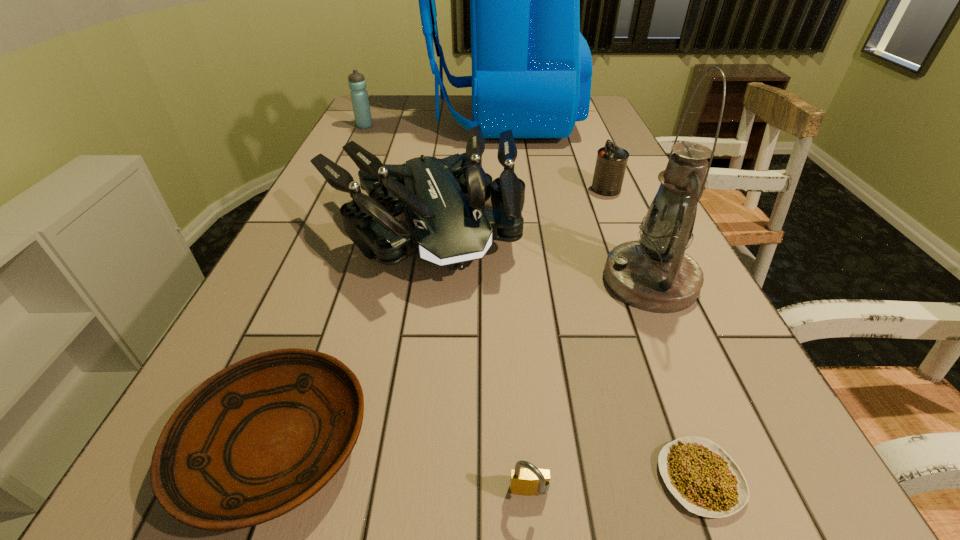
Identify the location of oil lamp situated at the right edge. (654, 274).

Identify the location of can that is at the right edge. The image size is (960, 540). (611, 162).

Identify the location of legume positioned at the right edge. Image resolution: width=960 pixels, height=540 pixels. (699, 473).

Image resolution: width=960 pixels, height=540 pixels. In order to click on object that is at the far right corner in this screenshot , I will do `click(531, 67)`.

This screenshot has width=960, height=540. Find the location of `object that is at the near right corner`. object that is at the near right corner is located at coordinates (699, 473).

In the image, there is a desktop. At what (x,y) coordinates should I click in order to perform the action: click on vacant space at the far edge. Please return your answer as a coordinate pair (x, y). The image size is (960, 540). Looking at the image, I should click on (473, 119).

Where is `free space at the near edge`? Image resolution: width=960 pixels, height=540 pixels. free space at the near edge is located at coordinates (654, 520).

You are a GUI agent. You are given a task and a screenshot of the screen. Output one action in this format:
    pyautogui.click(x=<x>, y=<y>)
    Task: Click on the free space at the left edge
    
    Given the screenshot: What is the action you would take?
    pyautogui.click(x=383, y=124)

The image size is (960, 540). In the image, there is a desktop. Identify the location of vacant region at the right edge. (702, 348).

The width and height of the screenshot is (960, 540). I want to click on blank area at the far left corner, so click(x=395, y=113).